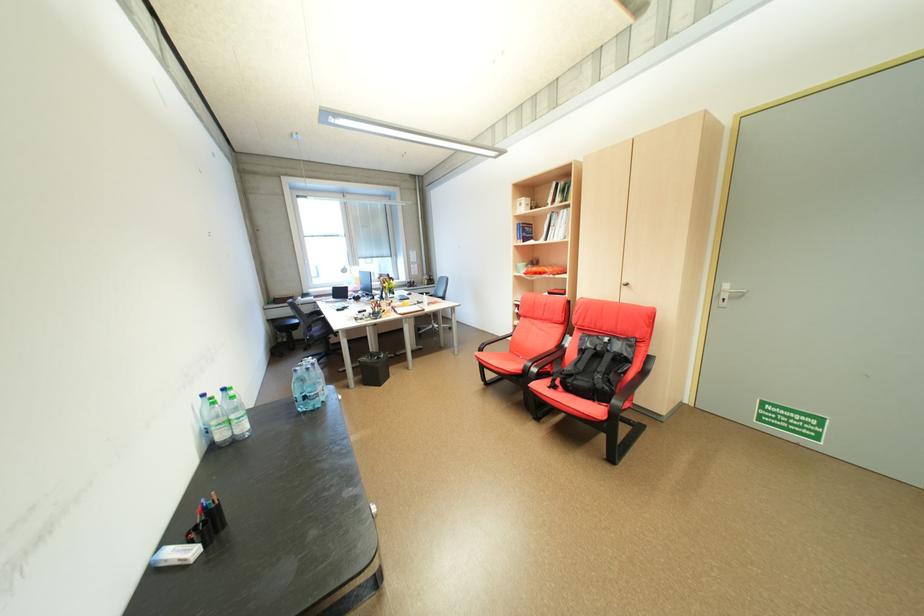
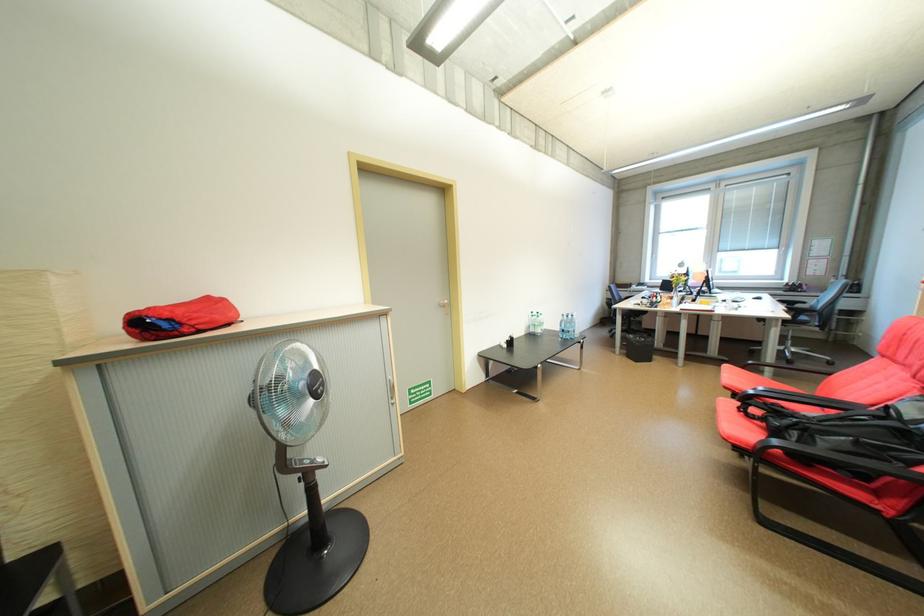
Locate, in the second image, the point that corresponds to (414,293) in the first image.

(758, 296)